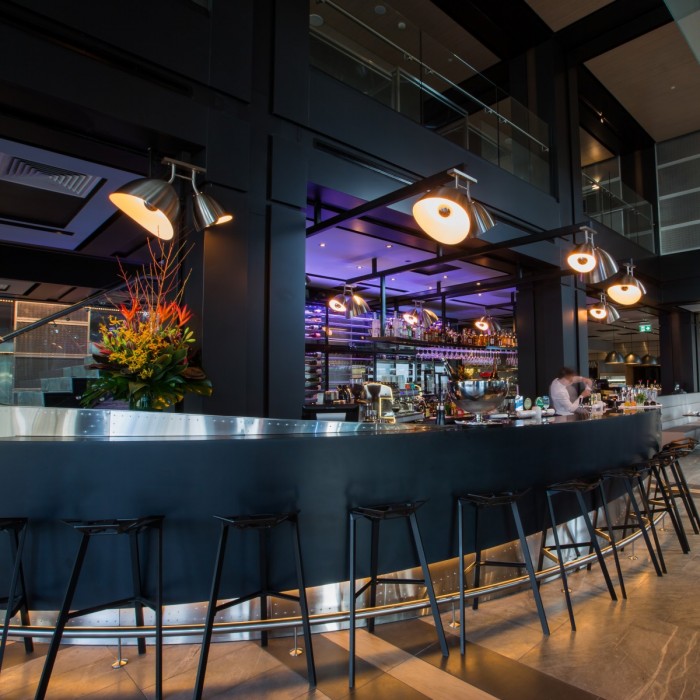
You are a GUI agent. You are given a task and a screenshot of the screen. Output one action in this format:
    pyautogui.click(x=<x>, y=<y>)
    Task: Click on the hanging upside down drink glasses
    This screenshot has width=700, height=700.
    Given the screenshot: What is the action you would take?
    pyautogui.click(x=460, y=355)